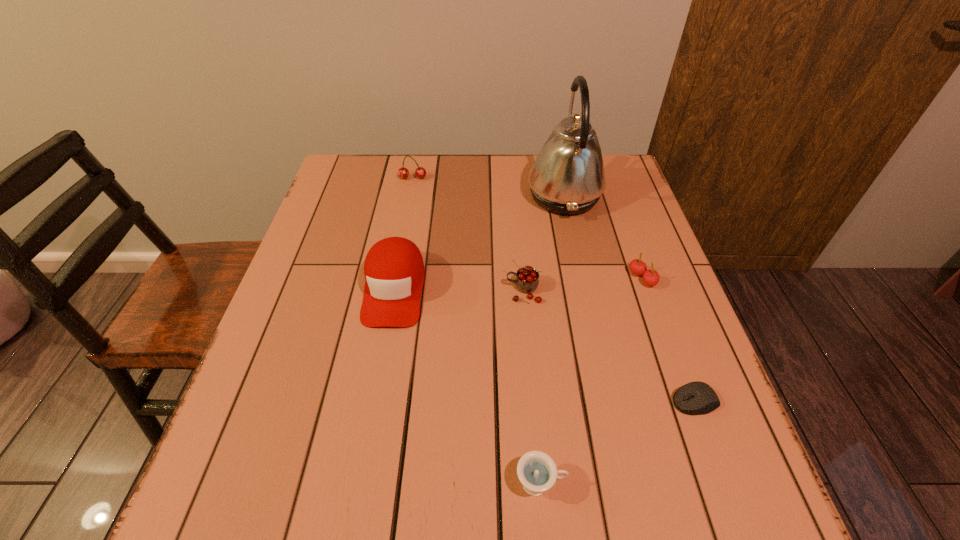
Identify the location of free point that satisfies the following two spatial constraints: 1. from the spout of the computer equipment; 2. on the left side of the tallest object. This screenshot has width=960, height=540. (610, 401).

Locate an element on the screen. free space that satisfies the following two spatial constraints: 1. with stems pointing upwards on the farthest cherry; 2. on the handle side of the second cherry from left to right is located at coordinates (392, 291).

Find the location of a particular element. This screenshot has width=960, height=540. vacant region that satisfies the following two spatial constraints: 1. on the front-facing side of the baseball cap; 2. on the left side of the shortest object is located at coordinates (373, 401).